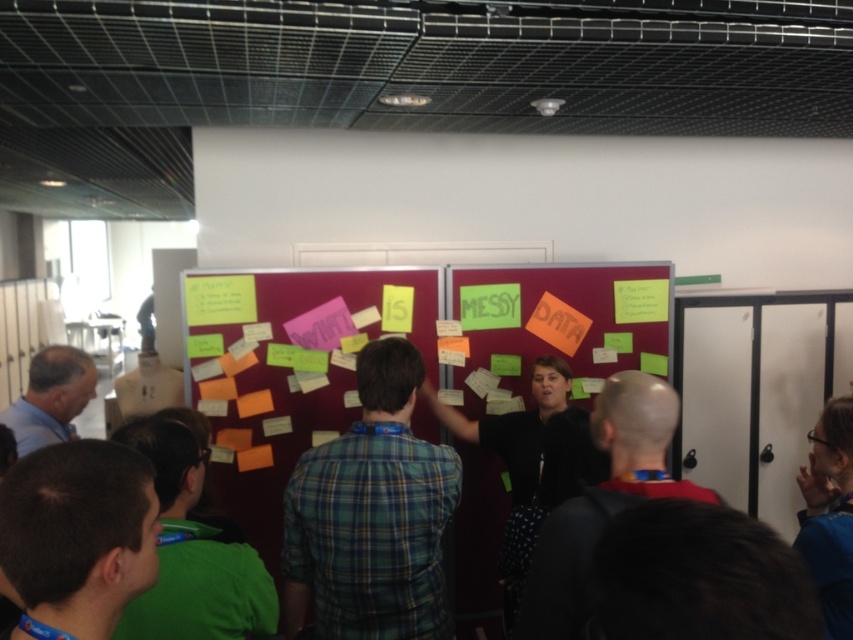
Question: Observing the image, what is the correct spatial positioning of dark gray hoodie at center in reference to blue fabric shirt at upper right?

Choices:
 (A) right
 (B) left

Answer: (B)

Question: Which object is farther from the camera taking this photo?

Choices:
 (A) green plaid shirt at center
 (B) dark gray hoodie at center

Answer: (A)

Question: Does blue fabric shirt at upper right lie in front of light brown leather jacket at lower left?

Choices:
 (A) yes
 (B) no

Answer: (A)

Question: Among these points, which one is nearest to the camera?

Choices:
 (A) (105, 540)
 (B) (68, 403)

Answer: (A)

Question: Is green plaid shirt at center below green fabric shirt at lower left?

Choices:
 (A) no
 (B) yes

Answer: (B)

Question: Which object is farther from the camera taking this photo?

Choices:
 (A) light brown leather jacket at lower left
 (B) maroon fabric bulletin board at center
 (C) green plaid shirt at lower left

Answer: (B)